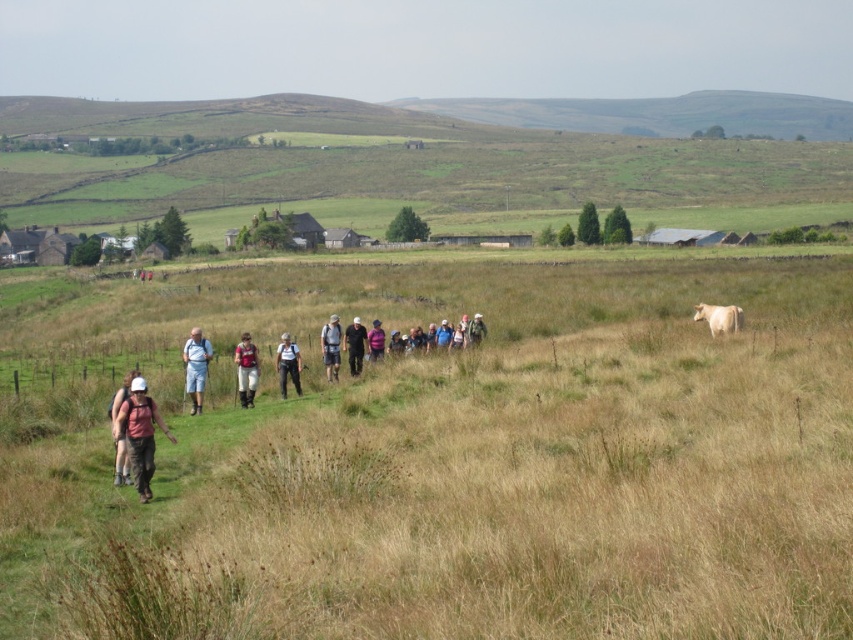
Question: Which object is positioned farthest from the dark gray backpack at center?

Choices:
 (A) light blue denim shorts at center
 (B) camouflage fabric backpack at center

Answer: (B)

Question: Which object is farther from the camera taking this photo?

Choices:
 (A) light blue denim shorts at center
 (B) dry grass at center
 (C) purple fabric jacket at center

Answer: (C)

Question: Which point is farther from the camera taking this photo?

Choices:
 (A) (460, 387)
 (B) (251, 349)

Answer: (B)

Question: Is camouflage fabric backpack at lower left positioned in front of white smooth cow at right?

Choices:
 (A) yes
 (B) no

Answer: (A)

Question: Can you confirm if white smooth cow at right is wider than dark gray backpack at center?

Choices:
 (A) no
 (B) yes

Answer: (B)

Question: Does white smooth cow at right come in front of dark gray backpack at center?

Choices:
 (A) yes
 (B) no

Answer: (A)